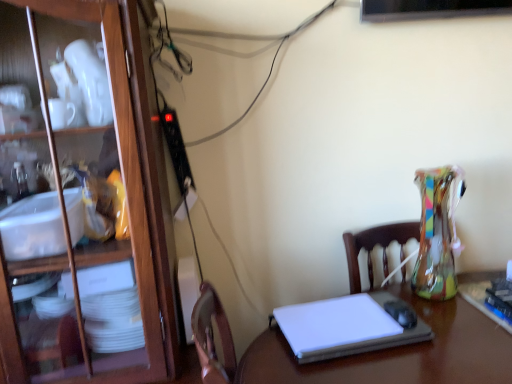
Locate an element on the screen. The width and height of the screenshot is (512, 384). vacant area on top of white matte laptop at center (from a real-world perspective) is located at coordinates (354, 320).